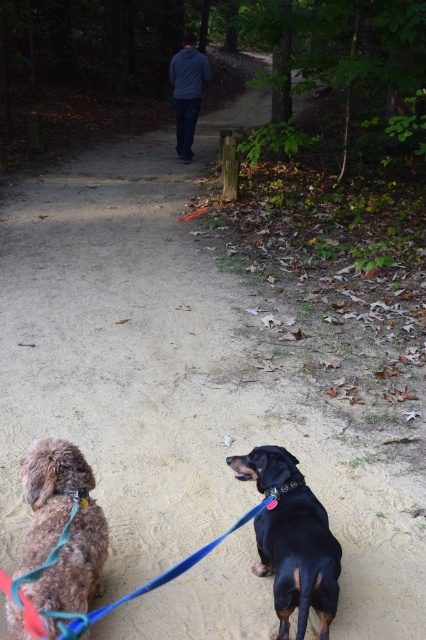
You are standing at the point marked by the coordinates point (276, 492) in the forest scene. You want to throw a ball to a friend who is standing exactly where the viewer is positioned. If the ball travels in a straight line, will it pass over the two dogs on the leash in the foreground?

The point marked by the coordinates point (276, 492) and the viewer are 6.98 feet apart. Since the two dogs are positioned in the foreground between the point and the viewer, the ball thrown in a straight line from the point to the viewer would pass over the dogs on the leash in the foreground.

You are standing in the forest and see two points marked on the ground. One is at point coordinate [29,541] and the other at [291,481]. Which point is nearer to you?

Point coordinate [29,541] is closer to the viewer than point coordinate [291,481].